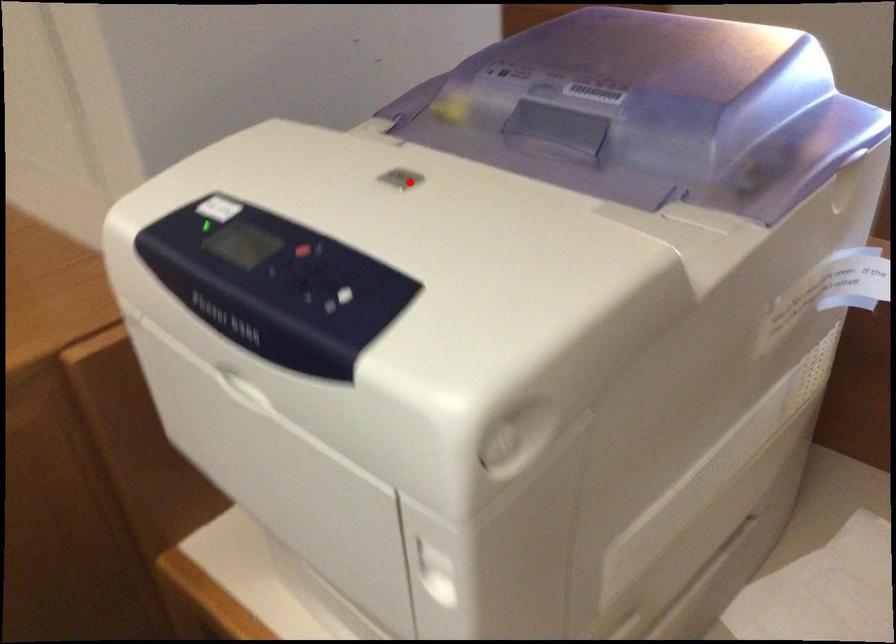
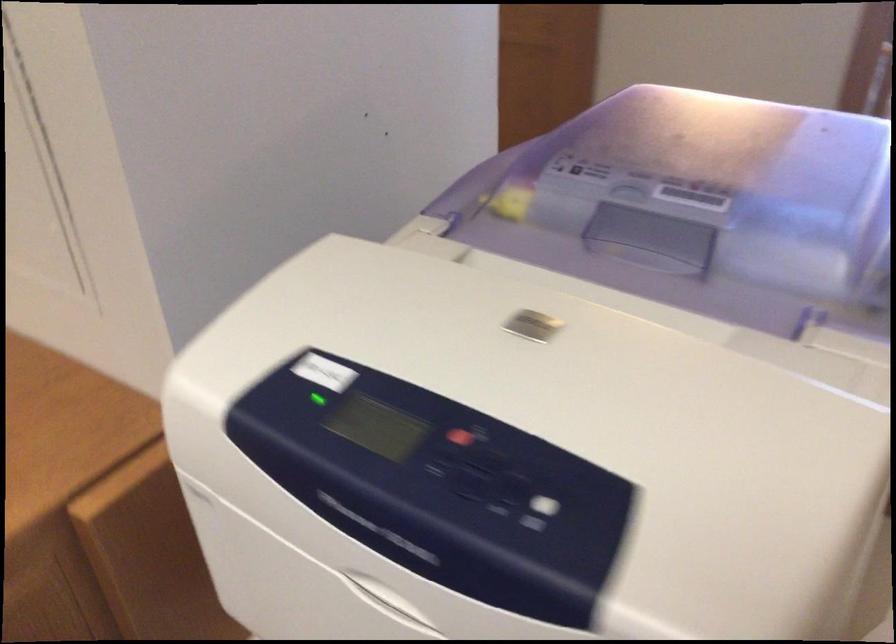
Find the pixel in the second image that matches the highlighted location in the first image.

(539, 325)